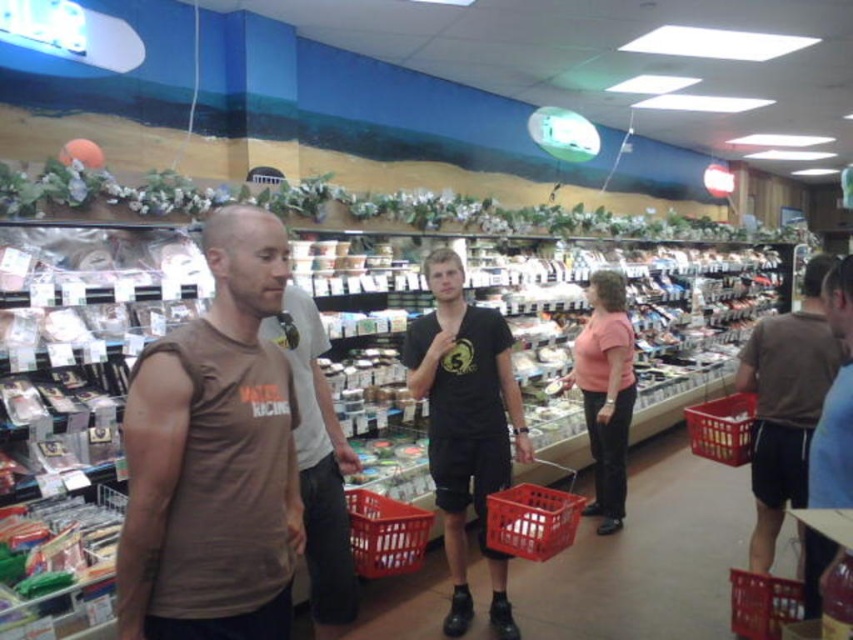
Based on the photo, you are a store employee who needs to move a 3.5 feet wide display stand between the red plastic basket at center and the plastic basket at lower right. Can you fit the display stand in the space between them?

The distance between the red plastic basket at center and the plastic basket at lower right is 4.11 feet, which is wider than the 3.5 feet width of the display stand. Therefore, the display stand can fit between them.